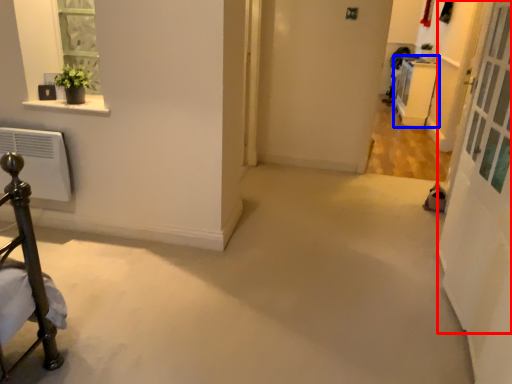
Question: Which object is further to the camera taking this photo, screen door (highlighted by a red box) or furniture (highlighted by a blue box)?

Choices:
 (A) screen door
 (B) furniture

Answer: (B)